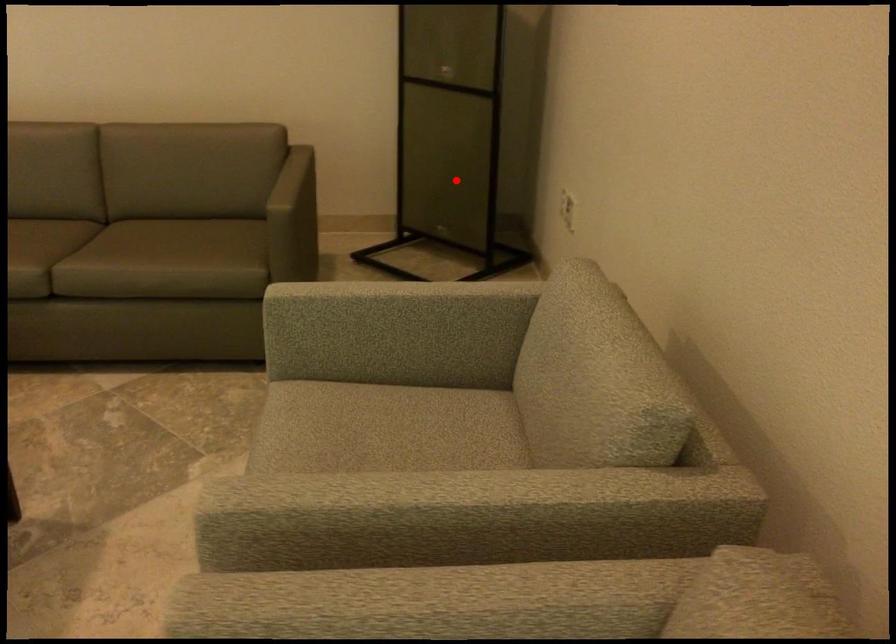
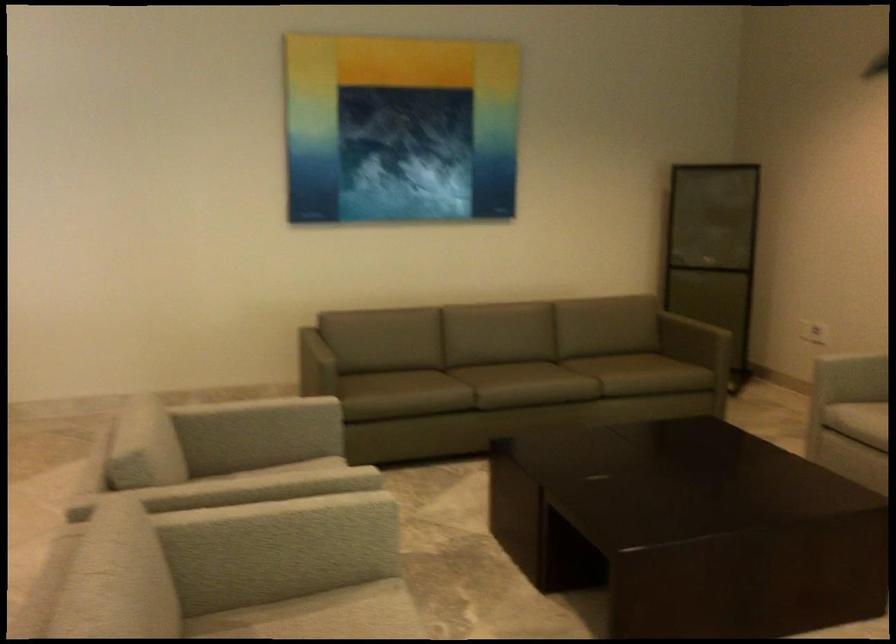
Locate, in the second image, the point that corresponds to the highlighted location in the first image.

(713, 317)